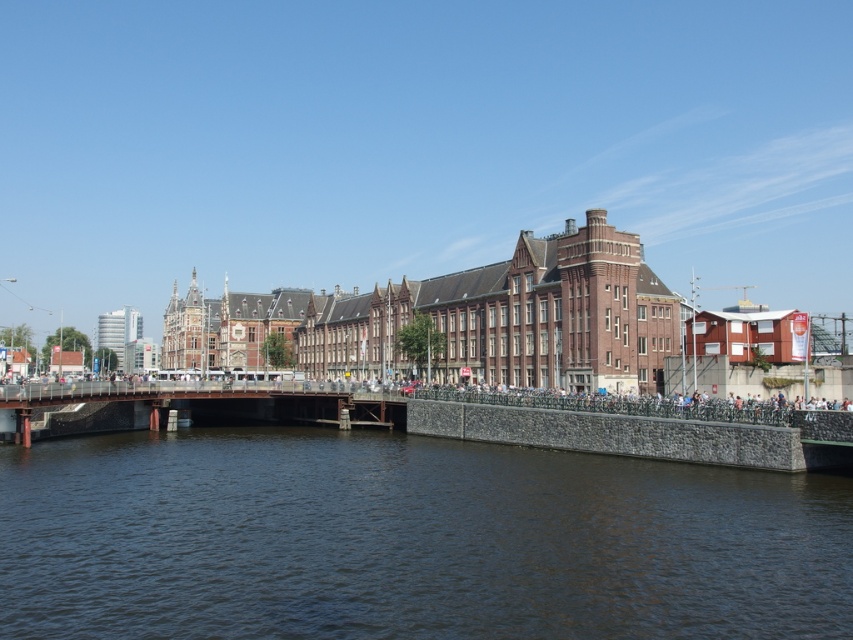
Does dark brown water at center appear on the left side of brown metal bridge at center?

No, dark brown water at center is not to the left of brown metal bridge at center.

At what (x,y) coordinates should I click in order to perform the action: click on dark brown water at center. Please return your answer as a coordinate pair (x, y). The height and width of the screenshot is (640, 853). Looking at the image, I should click on point(408,540).

Where is `dark brown water at center`? The image size is (853, 640). dark brown water at center is located at coordinates (408, 540).